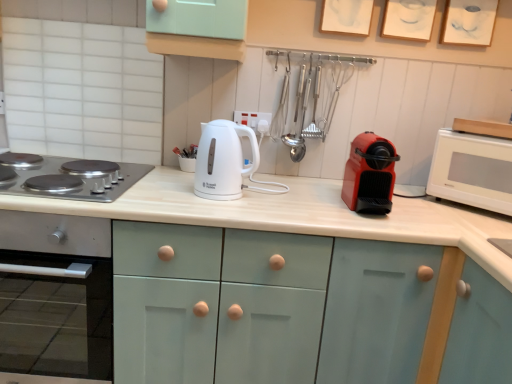
Question: Is the position of white matte countertop at center more distant than that of white glossy microwave at right?

Choices:
 (A) yes
 (B) no

Answer: (B)

Question: Does white matte countertop at center have a lesser height compared to white glossy microwave at right?

Choices:
 (A) no
 (B) yes

Answer: (A)

Question: Does white matte countertop at center have a greater height compared to white glossy microwave at right?

Choices:
 (A) no
 (B) yes

Answer: (B)

Question: Does white matte countertop at center appear on the right side of white glossy microwave at right?

Choices:
 (A) yes
 (B) no

Answer: (B)

Question: Does white matte countertop at center touch white glossy microwave at right?

Choices:
 (A) yes
 (B) no

Answer: (B)

Question: From the image's perspective, is white matte countertop at center over white glossy microwave at right?

Choices:
 (A) yes
 (B) no

Answer: (B)

Question: Is the position of stainless steel gas stove at left less distant than that of white glossy microwave at right?

Choices:
 (A) no
 (B) yes

Answer: (B)

Question: Is stainless steel gas stove at left oriented towards white glossy microwave at right?

Choices:
 (A) no
 (B) yes

Answer: (A)

Question: From the image's perspective, is stainless steel gas stove at left located beneath white glossy microwave at right?

Choices:
 (A) no
 (B) yes

Answer: (A)

Question: Can you confirm if stainless steel gas stove at left is smaller than white glossy microwave at right?

Choices:
 (A) yes
 (B) no

Answer: (A)

Question: Can you confirm if stainless steel gas stove at left is shorter than white glossy microwave at right?

Choices:
 (A) no
 (B) yes

Answer: (B)

Question: Considering the relative sizes of stainless steel gas stove at left and white glossy microwave at right in the image provided, is stainless steel gas stove at left bigger than white glossy microwave at right?

Choices:
 (A) yes
 (B) no

Answer: (B)

Question: Does white matte countertop at center have a greater height compared to stainless steel gas stove at left?

Choices:
 (A) yes
 (B) no

Answer: (A)